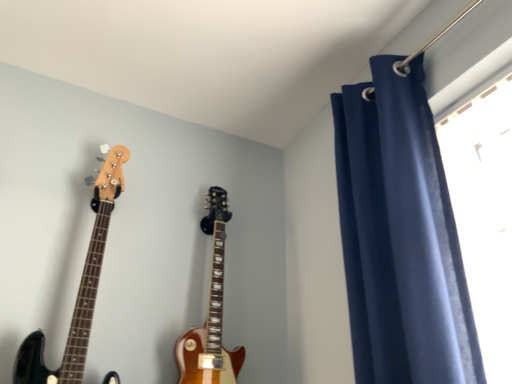
Describe the element at coordinates (211, 312) in the screenshot. The width and height of the screenshot is (512, 384). I see `glossy wood guitar at center, marked as the 2th guitar in a left-to-right arrangement` at that location.

How much space does glossy wood guitar at center, marked as the 2th guitar in a left-to-right arrangement, occupy horizontally?

The width of glossy wood guitar at center, marked as the 2th guitar in a left-to-right arrangement, is 5.55 inches.

This screenshot has height=384, width=512. In order to click on navy blue velvet curtain at upper right in this screenshot , I will do `click(400, 236)`.

The height and width of the screenshot is (384, 512). What do you see at coordinates (79, 290) in the screenshot?
I see `glossy wood guitar at left, the second guitar positioned from the right` at bounding box center [79, 290].

At what (x,y) coordinates should I click in order to perform the action: click on glossy wood guitar at center, marked as the 2th guitar in a left-to-right arrangement. Please return your answer as a coordinate pair (x, y). Looking at the image, I should click on (211, 312).

From the picture: From a real-world perspective, which object rests below the other?

glossy wood guitar at center, which is the 1th guitar from right to left, from a real-world perspective.

Is glossy wood guitar at center, marked as the 2th guitar in a left-to-right arrangement, positioned before navy blue velvet curtain at upper right?

No, the depth of glossy wood guitar at center, marked as the 2th guitar in a left-to-right arrangement, is greater than that of navy blue velvet curtain at upper right.

Is point (206, 352) closer to camera compared to point (395, 117)?

No, (206, 352) is further to viewer.

Is glossy wood guitar at center, marked as the 2th guitar in a left-to-right arrangement, not inside navy blue velvet curtain at upper right?

Absolutely, glossy wood guitar at center, marked as the 2th guitar in a left-to-right arrangement, is external to navy blue velvet curtain at upper right.

In the image, is navy blue velvet curtain at upper right on the left side or the right side of glossy wood guitar at center, marked as the 2th guitar in a left-to-right arrangement?

Clearly, navy blue velvet curtain at upper right is on the right of glossy wood guitar at center, marked as the 2th guitar in a left-to-right arrangement, in the image.

From the image's perspective, is navy blue velvet curtain at upper right above glossy wood guitar at center, which is the 1th guitar from right to left?

Yes.

How much distance is there between navy blue velvet curtain at upper right and glossy wood guitar at center, marked as the 2th guitar in a left-to-right arrangement?

24.38 inches.

Which of these two, navy blue velvet curtain at upper right or glossy wood guitar at center, which is the 1th guitar from right to left, stands taller?

Standing taller between the two is navy blue velvet curtain at upper right.

Is glossy wood guitar at center, which is the 1th guitar from right to left, bigger than glossy wood guitar at left, acting as the 1th guitar starting from the left?

Incorrect, glossy wood guitar at center, which is the 1th guitar from right to left, is not larger than glossy wood guitar at left, acting as the 1th guitar starting from the left.

Which of these two, glossy wood guitar at center, marked as the 2th guitar in a left-to-right arrangement, or glossy wood guitar at left, the second guitar positioned from the right, is thinner?

With smaller width is glossy wood guitar at center, marked as the 2th guitar in a left-to-right arrangement.

Would you say glossy wood guitar at center, marked as the 2th guitar in a left-to-right arrangement, is inside or outside glossy wood guitar at left, acting as the 1th guitar starting from the left?

glossy wood guitar at center, marked as the 2th guitar in a left-to-right arrangement, cannot be found inside glossy wood guitar at left, acting as the 1th guitar starting from the left.

From the image's perspective, is glossy wood guitar at center, which is the 1th guitar from right to left, located above or below glossy wood guitar at left, the second guitar positioned from the right?

glossy wood guitar at center, which is the 1th guitar from right to left, is below glossy wood guitar at left, the second guitar positioned from the right.

Is glossy wood guitar at left, the second guitar positioned from the right, taller or shorter than glossy wood guitar at center, marked as the 2th guitar in a left-to-right arrangement?

Clearly, glossy wood guitar at left, the second guitar positioned from the right, is taller compared to glossy wood guitar at center, marked as the 2th guitar in a left-to-right arrangement.

Can you confirm if glossy wood guitar at left, acting as the 1th guitar starting from the left, is thinner than glossy wood guitar at center, which is the 1th guitar from right to left?

In fact, glossy wood guitar at left, acting as the 1th guitar starting from the left, might be wider than glossy wood guitar at center, which is the 1th guitar from right to left.

At what (x,y) coordinates should I click in order to perform the action: click on guitar below the glossy wood guitar at left, acting as the 1th guitar starting from the left (from a real-world perspective). Please return your answer as a coordinate pair (x, y). This screenshot has height=384, width=512. Looking at the image, I should click on (211, 312).

Based on the photo, is navy blue velvet curtain at upper right next to glossy wood guitar at left, the second guitar positioned from the right, and touching it?

No, navy blue velvet curtain at upper right is not making contact with glossy wood guitar at left, the second guitar positioned from the right.

Starting from the navy blue velvet curtain at upper right, which guitar is the 2nd one to the left? Please provide its 2D coordinates.

[(79, 290)]

Which is more to the right, navy blue velvet curtain at upper right or glossy wood guitar at left, the second guitar positioned from the right?

navy blue velvet curtain at upper right.

Is navy blue velvet curtain at upper right spatially inside glossy wood guitar at left, acting as the 1th guitar starting from the left, or outside of it?

navy blue velvet curtain at upper right lies outside glossy wood guitar at left, acting as the 1th guitar starting from the left.

Can you confirm if glossy wood guitar at left, acting as the 1th guitar starting from the left, is taller than navy blue velvet curtain at upper right?

No, glossy wood guitar at left, acting as the 1th guitar starting from the left, is not taller than navy blue velvet curtain at upper right.

Where is `curtain that appears above the glossy wood guitar at left, acting as the 1th guitar starting from the left (from the image's perspective)`? curtain that appears above the glossy wood guitar at left, acting as the 1th guitar starting from the left (from the image's perspective) is located at coordinates pyautogui.click(x=400, y=236).

Looking at this image, from the image's perspective, relative to navy blue velvet curtain at upper right, is glossy wood guitar at left, the second guitar positioned from the right, above or below?

Based on their image positions, glossy wood guitar at left, the second guitar positioned from the right, is located beneath navy blue velvet curtain at upper right.

Is glossy wood guitar at left, the second guitar positioned from the right, smaller than navy blue velvet curtain at upper right?

Yes, glossy wood guitar at left, the second guitar positioned from the right, is smaller than navy blue velvet curtain at upper right.

This screenshot has width=512, height=384. In order to click on guitar that is the 1st object to the left of the navy blue velvet curtain at upper right, starting at the anchor in this screenshot , I will do `click(211, 312)`.

From a real-world perspective, starting from the navy blue velvet curtain at upper right, which guitar is the 2nd one below it? Please provide its 2D coordinates.

[(211, 312)]

From the image, which object appears to be nearer to navy blue velvet curtain at upper right, glossy wood guitar at left, the second guitar positioned from the right, or glossy wood guitar at center, marked as the 2th guitar in a left-to-right arrangement?

Based on the image, glossy wood guitar at center, marked as the 2th guitar in a left-to-right arrangement, appears to be nearer to navy blue velvet curtain at upper right.

Considering their positions, is glossy wood guitar at left, acting as the 1th guitar starting from the left, positioned further to glossy wood guitar at center, marked as the 2th guitar in a left-to-right arrangement, than navy blue velvet curtain at upper right?

Among the two, navy blue velvet curtain at upper right is located further to glossy wood guitar at center, marked as the 2th guitar in a left-to-right arrangement.

Based on their spatial positions, is navy blue velvet curtain at upper right or glossy wood guitar at left, acting as the 1th guitar starting from the left, further from glossy wood guitar at center, which is the 1th guitar from right to left?

Among the two, navy blue velvet curtain at upper right is located further to glossy wood guitar at center, which is the 1th guitar from right to left.

Estimate the real-world distances between objects in this image. Which object is closer to navy blue velvet curtain at upper right, glossy wood guitar at center, marked as the 2th guitar in a left-to-right arrangement, or glossy wood guitar at left, acting as the 1th guitar starting from the left?

glossy wood guitar at center, marked as the 2th guitar in a left-to-right arrangement, is positioned closer to the anchor navy blue velvet curtain at upper right.

Which object lies further to the anchor point glossy wood guitar at left, acting as the 1th guitar starting from the left, navy blue velvet curtain at upper right or glossy wood guitar at center, which is the 1th guitar from right to left?

navy blue velvet curtain at upper right lies further to glossy wood guitar at left, acting as the 1th guitar starting from the left, than the other object.

Estimate the real-world distances between objects in this image. Which object is closer to glossy wood guitar at left, acting as the 1th guitar starting from the left, glossy wood guitar at center, which is the 1th guitar from right to left, or navy blue velvet curtain at upper right?

Based on the image, glossy wood guitar at center, which is the 1th guitar from right to left, appears to be nearer to glossy wood guitar at left, acting as the 1th guitar starting from the left.

Where is `guitar between glossy wood guitar at left, acting as the 1th guitar starting from the left, and navy blue velvet curtain at upper right, in the horizontal direction`? guitar between glossy wood guitar at left, acting as the 1th guitar starting from the left, and navy blue velvet curtain at upper right, in the horizontal direction is located at coordinates coord(211,312).